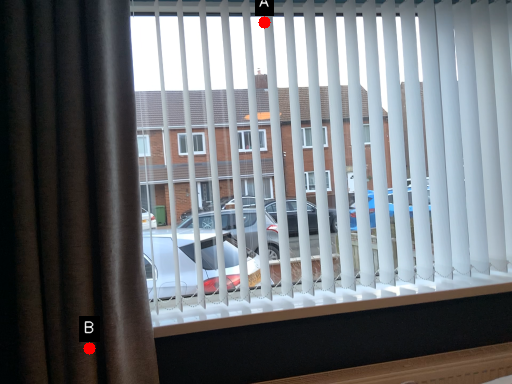
Question: Two points are circled on the image, labeled by A and B beside each circle. Among these points, which one is nearest to the camera?

Choices:
 (A) A is closer
 (B) B is closer

Answer: (B)